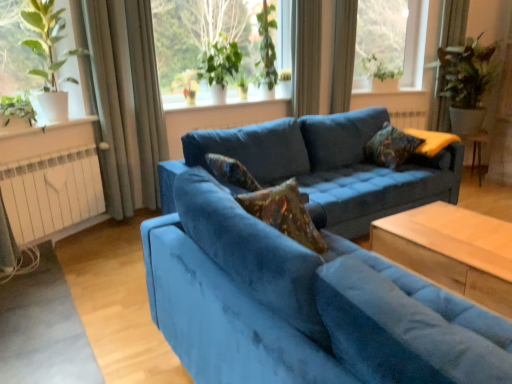
The image size is (512, 384). Find the location of `free spot below gray fabric curtain at left, the 4th curtain when ordered from right to left (from a real-world perspective)`. free spot below gray fabric curtain at left, the 4th curtain when ordered from right to left (from a real-world perspective) is located at coordinates (124, 221).